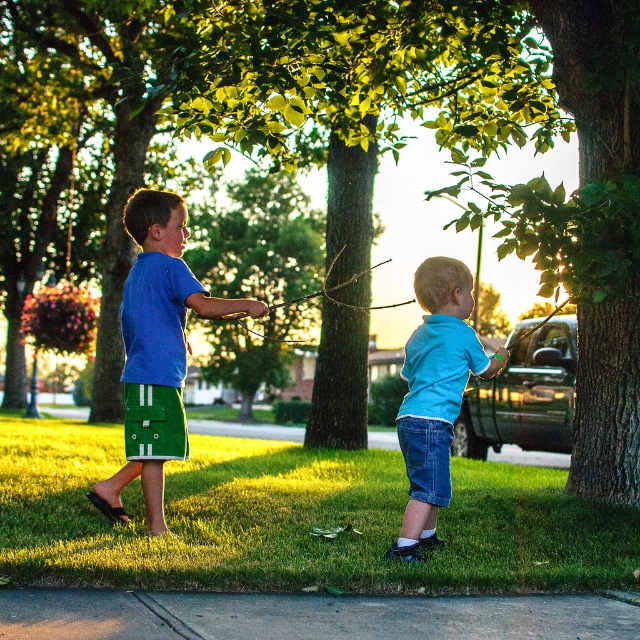
Question: Which point is closer to the camera?

Choices:
 (A) (170, 320)
 (B) (499, 368)
 (C) (264, 310)

Answer: (C)

Question: Does smooth asphalt sidewalk at lower center have a smaller size compared to smooth skin hand at center?

Choices:
 (A) no
 (B) yes

Answer: (A)

Question: Can you confirm if green rough bark tree at right is positioned to the right of matte blue t-shirt at center?

Choices:
 (A) no
 (B) yes

Answer: (B)

Question: Which of these objects is positioned closest to the smooth skin hand at center?

Choices:
 (A) green grass at lower center
 (B) matte blue t-shirt at center
 (C) smooth asphalt sidewalk at lower center
 (D) green rough bark tree at right

Answer: (B)

Question: Which of the following is the closest to the observer?

Choices:
 (A) blue denim shorts at lower center
 (B) matte blue t-shirt at center
 (C) smooth skin hand at center
 (D) smooth asphalt sidewalk at lower center

Answer: (D)

Question: Does green rough bark tree at right have a smaller size compared to smooth skin hand at center?

Choices:
 (A) no
 (B) yes

Answer: (A)